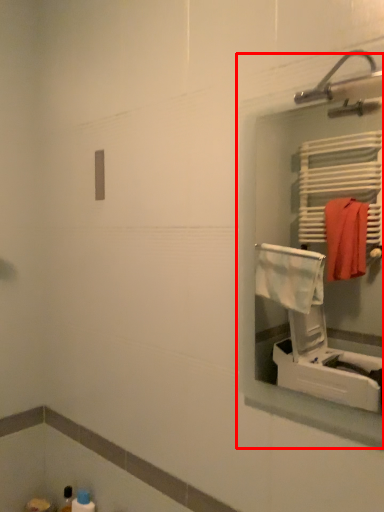
Question: From the image's perspective, where is medicine cabinet (annotated by the red box) located relative to toiletry?

Choices:
 (A) below
 (B) above

Answer: (B)